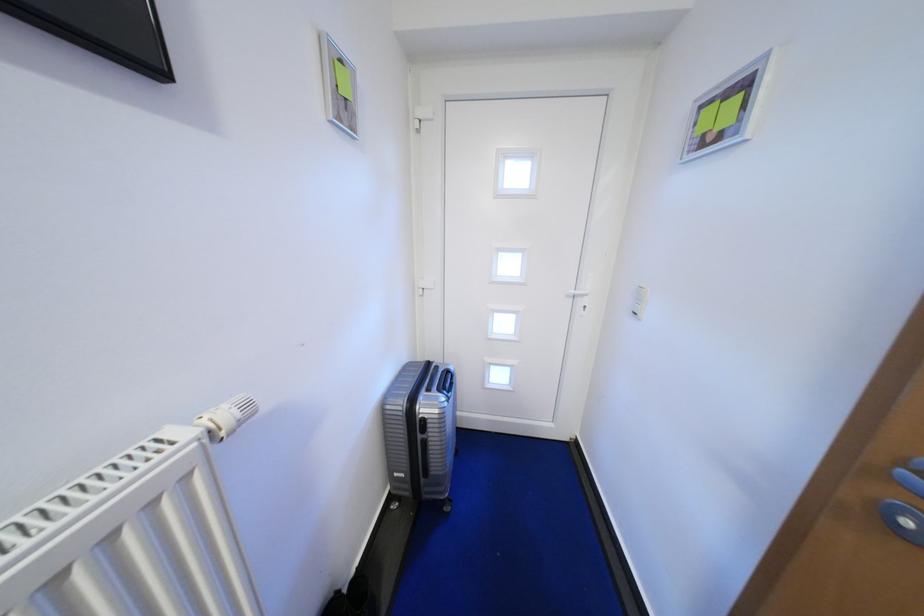
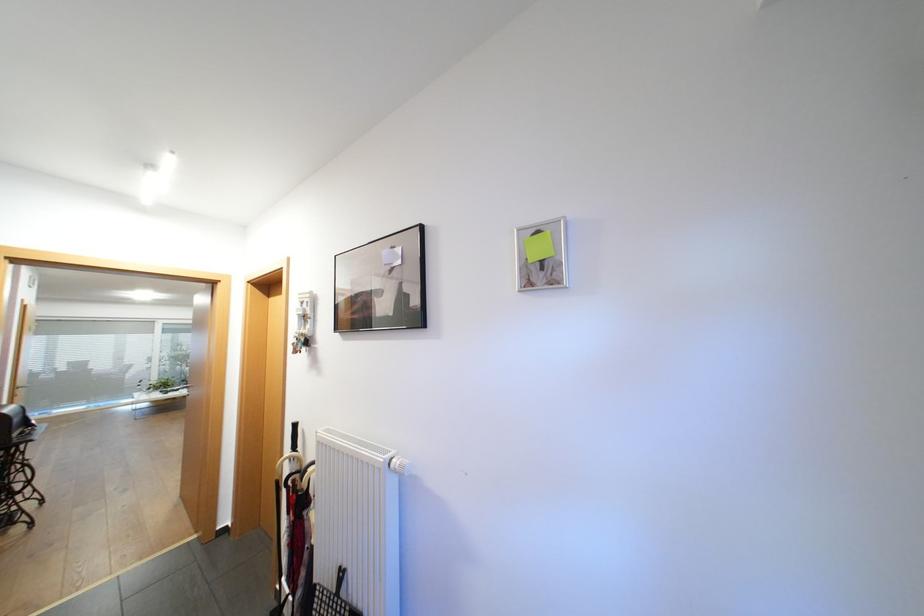
Where in the second image is the point corresponding to point (195, 434) from the first image?

(394, 456)